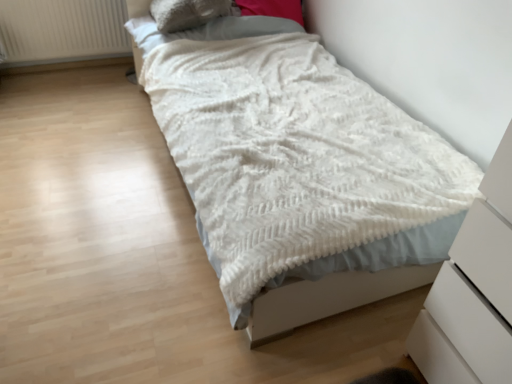
Question: From the image's perspective, is fuzzy beige pillow at upper center positioned above or below white textured blanket at center?

Choices:
 (A) below
 (B) above

Answer: (B)

Question: In the image, is fuzzy beige pillow at upper center on the left side or the right side of white textured blanket at center?

Choices:
 (A) right
 (B) left

Answer: (B)

Question: Based on their relative distances, which object is farther from the white matte chest of drawers at lower right?

Choices:
 (A) white textured radiator at upper left
 (B) white textured blanket at center
 (C) fuzzy beige pillow at upper center

Answer: (A)

Question: Which object is the farthest from the white matte chest of drawers at lower right?

Choices:
 (A) white textured blanket at center
 (B) fuzzy beige pillow at upper center
 (C) white textured radiator at upper left

Answer: (C)